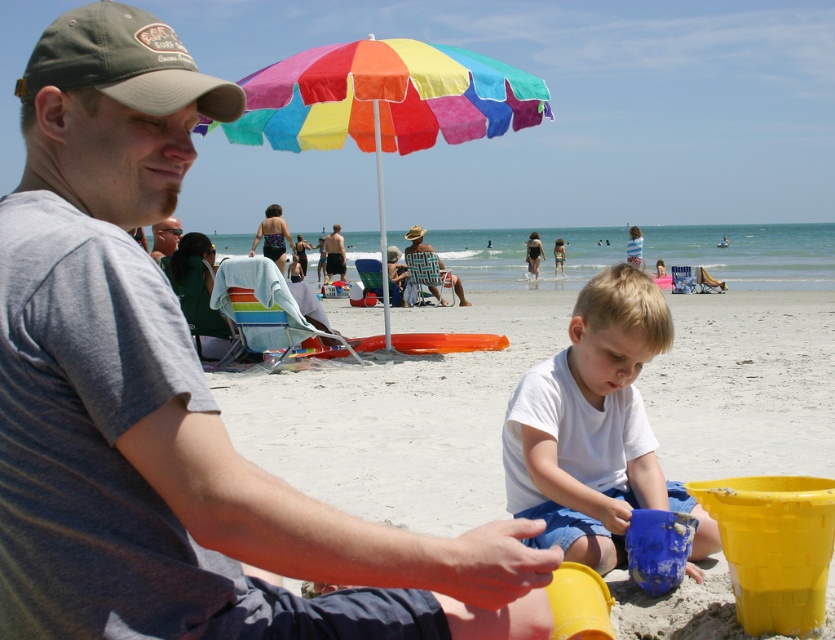
Between point (53, 52) and point (540, 102), which one is positioned behind?

The point (540, 102) is behind.

This screenshot has height=640, width=835. What do you see at coordinates (171, 401) in the screenshot?
I see `gray cotton shirt at upper left` at bounding box center [171, 401].

Where is `gray cotton shirt at upper left`? The height and width of the screenshot is (640, 835). gray cotton shirt at upper left is located at coordinates (171, 401).

Can you confirm if matte black sunglasses at upper left is smaller than matte black shorts at center?

Actually, matte black sunglasses at upper left might be larger than matte black shorts at center.

Is matte black sunglasses at upper left below matte black shorts at center?

Indeed, matte black sunglasses at upper left is positioned under matte black shorts at center.

Locate an element on the screen. The height and width of the screenshot is (640, 835). matte black sunglasses at upper left is located at coordinates (165, 237).

Who is shorter, white sand at center or matte black sunglasses at upper left?

With less height is white sand at center.

What do you see at coordinates (400, 417) in the screenshot? This screenshot has width=835, height=640. I see `white sand at center` at bounding box center [400, 417].

Locate an element on the screen. The height and width of the screenshot is (640, 835). white sand at center is located at coordinates click(400, 417).